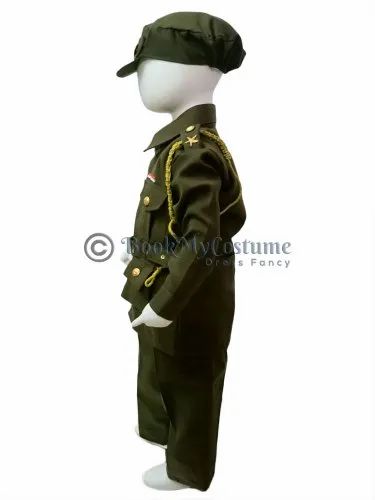
Where is `mannequin's head`? mannequin's head is located at coordinates (156, 76).